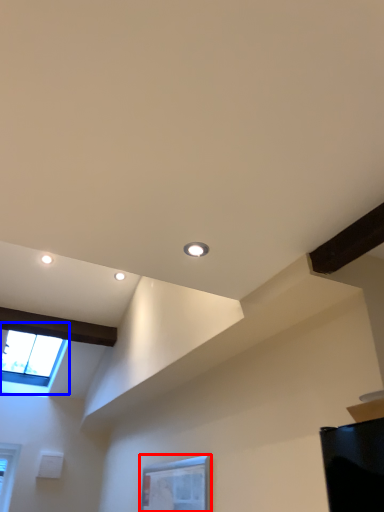
Question: Which object appears closest to the camera in this image, window (highlighted by a red box) or window (highlighted by a blue box)?

Choices:
 (A) window
 (B) window

Answer: (A)